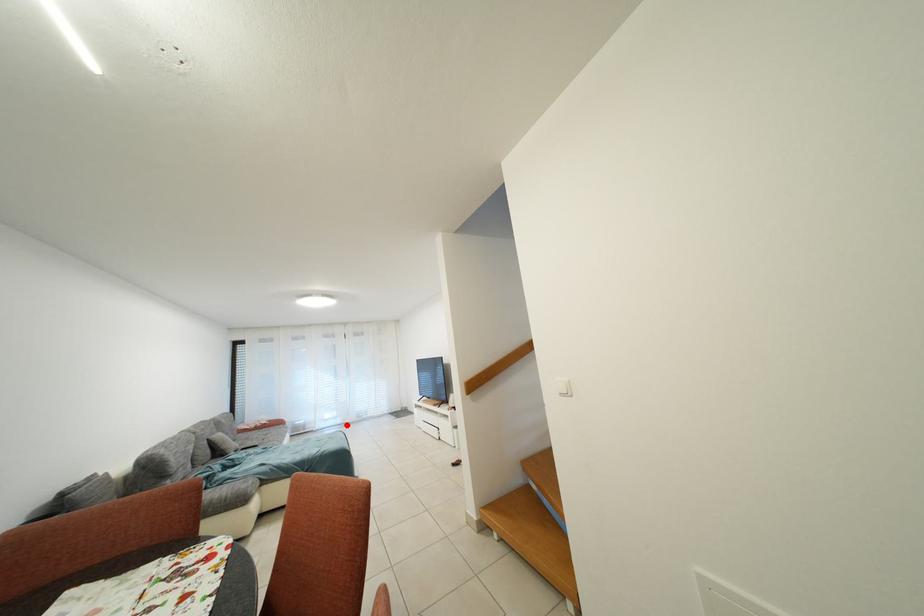
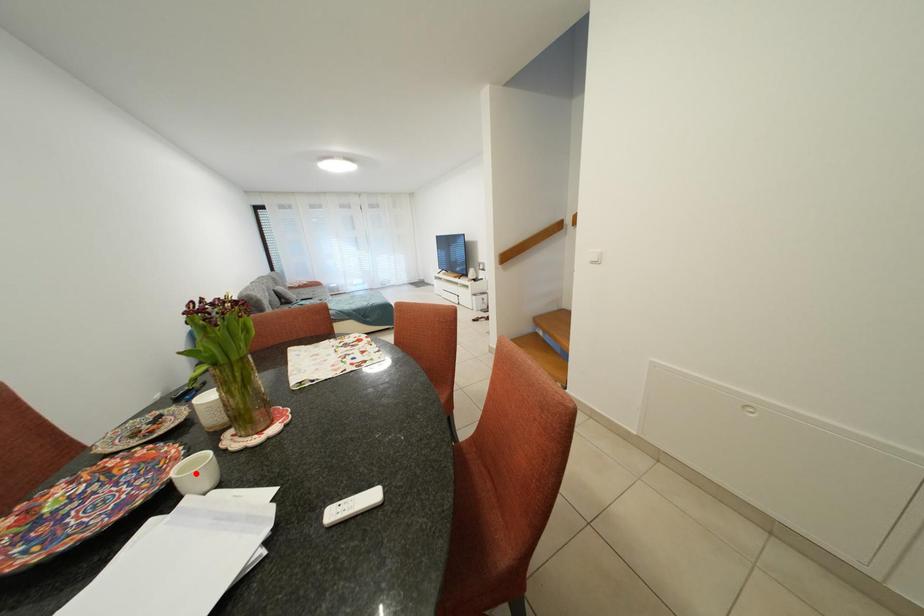
I am providing you with two images of the same scene from different viewpoints. A red point is marked on the first image and another point is marked on the second image. Do the highlighted points in image1 and image2 indicate the same real-world spot?

No